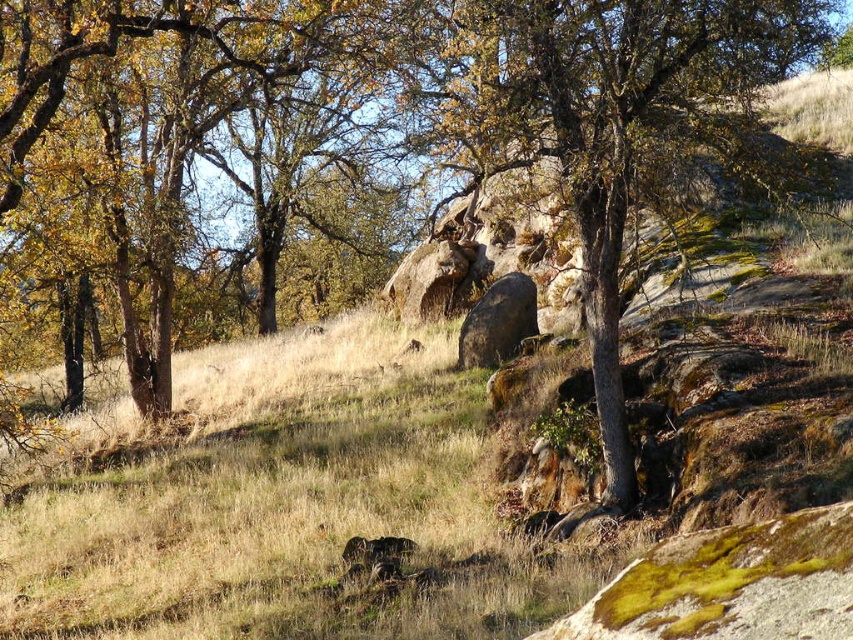
Does smooth gray tree at center lie behind brown rough rock at center?

No, smooth gray tree at center is closer to the viewer.

Is smooth gray tree at center below brown rough rock at center?

No.

Who is more forward, (520,90) or (531,336)?

Point (520,90) is more forward.

I want to click on smooth gray tree at center, so click(x=601, y=116).